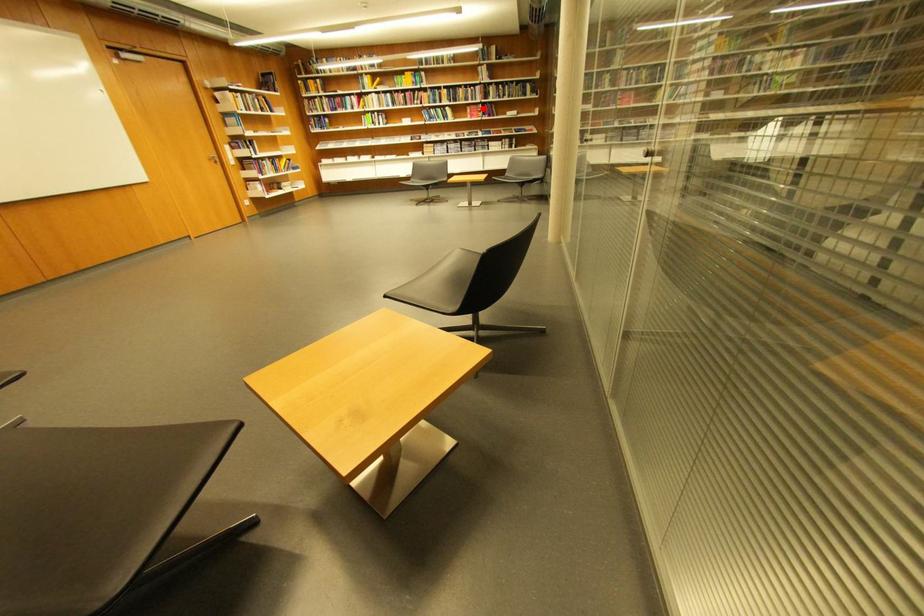
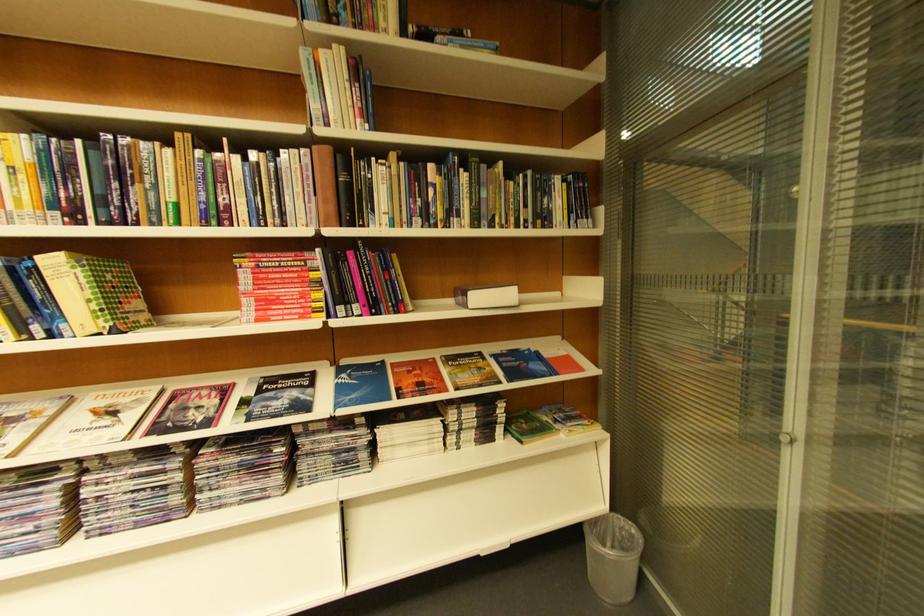
Locate, in the second image, the point that corresponds to the highlighted location in the first image.

(281, 262)